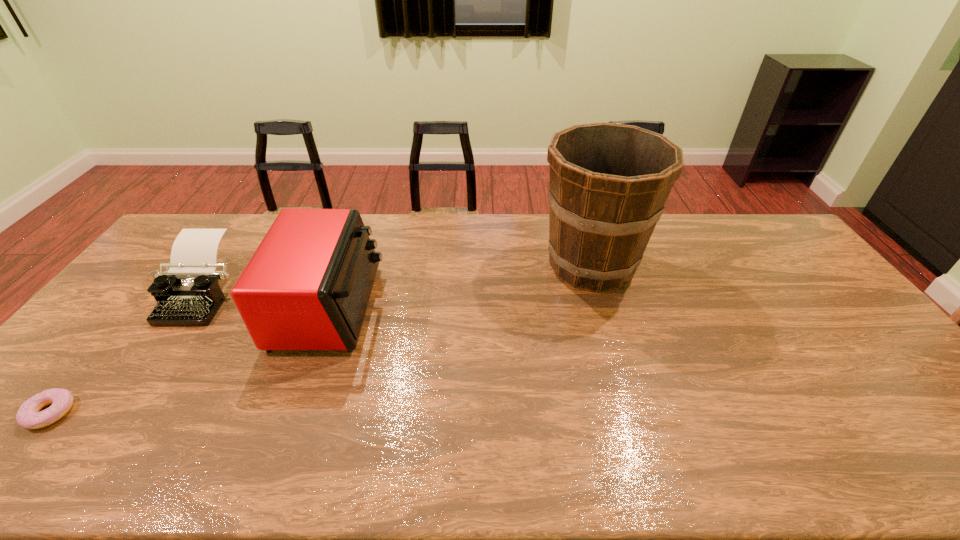
The image size is (960, 540). In order to click on blank area located 0.130m on the back of the nearest object in this screenshot , I will do `click(99, 353)`.

At what (x,y) coordinates should I click in order to perform the action: click on object that is positioned at the far edge. Please return your answer as a coordinate pair (x, y). The height and width of the screenshot is (540, 960). Looking at the image, I should click on (608, 183).

At what (x,y) coordinates should I click in order to perform the action: click on typewriter that is at the left edge. Please return your answer as a coordinate pair (x, y). This screenshot has height=540, width=960. Looking at the image, I should click on (188, 293).

Find the location of a particular element. The width and height of the screenshot is (960, 540). doughnut located in the left edge section of the desktop is located at coordinates (28, 416).

Identify the location of vacant space at the far edge of the desktop. The width and height of the screenshot is (960, 540). (546, 213).

I want to click on vacant region at the near edge, so click(201, 451).

This screenshot has height=540, width=960. In order to click on free space at the left edge of the desktop in this screenshot , I will do `click(73, 381)`.

Locate an element on the screen. Image resolution: width=960 pixels, height=540 pixels. free space at the right edge of the desktop is located at coordinates (791, 270).

Identify the location of free space between the typewriter and the doughnut. The image size is (960, 540). (125, 353).

Identify the location of vacant space that's between the second object from right to left and the nearest object. Image resolution: width=960 pixels, height=540 pixels. (189, 360).